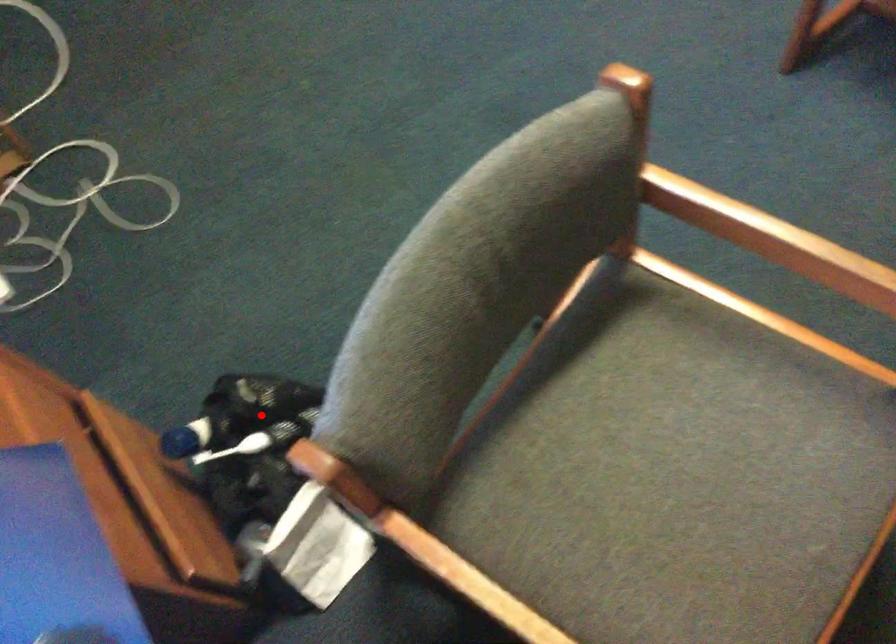
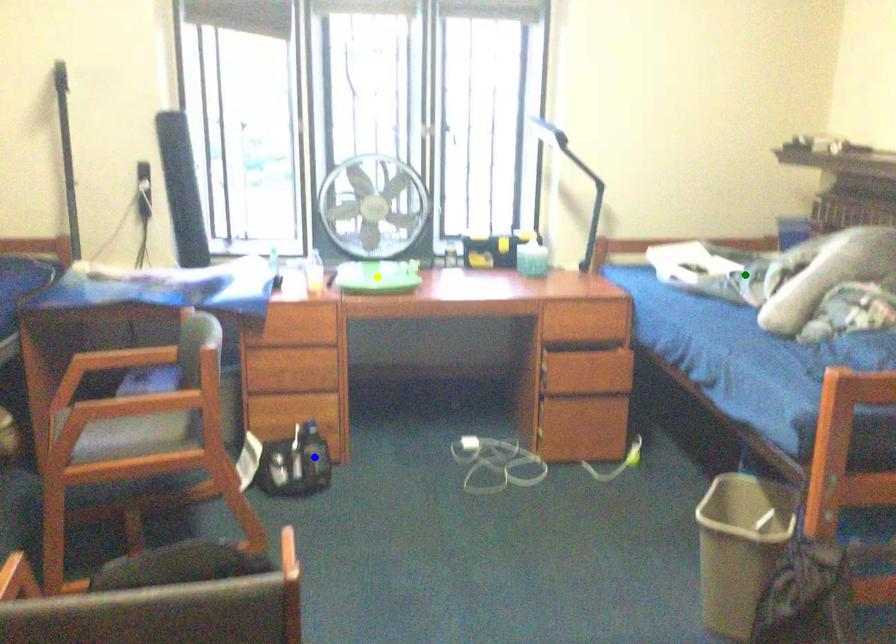
Question: I am providing you with two images of the same scene from different viewpoints. A red point is marked on the first image. You are given multiple points on the second image. Which mark in image 2 goes with the point in image 1?

Choices:
 (A) green point
 (B) yellow point
 (C) blue point

Answer: (C)